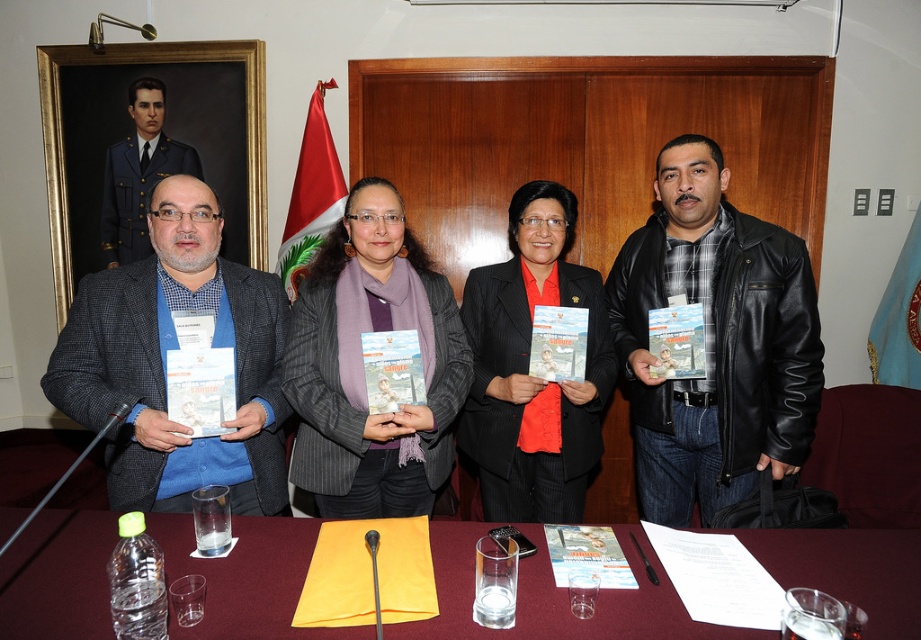
Question: Which object is farther from the camera taking this photo?

Choices:
 (A) matte blue shirt at left
 (B) maroon fabric table at center

Answer: (A)

Question: Observing the image, what is the correct spatial positioning of black leather jacket at right in reference to matte blue shirt at left?

Choices:
 (A) right
 (B) left

Answer: (A)

Question: Observing the image, what is the correct spatial positioning of maroon fabric table at center in reference to gray pinstripe blazer at center?

Choices:
 (A) left
 (B) right

Answer: (B)

Question: Which point is closer to the camera?

Choices:
 (A) click(x=339, y=419)
 (B) click(x=882, y=532)

Answer: (B)

Question: Considering the relative positions of black leather jacket at right and matte blue shirt at left in the image provided, where is black leather jacket at right located with respect to matte blue shirt at left?

Choices:
 (A) above
 (B) below

Answer: (A)

Question: Among these points, which one is farthest from the camera?

Choices:
 (A) (430, 275)
 (B) (278, 499)
 (C) (788, 291)

Answer: (A)